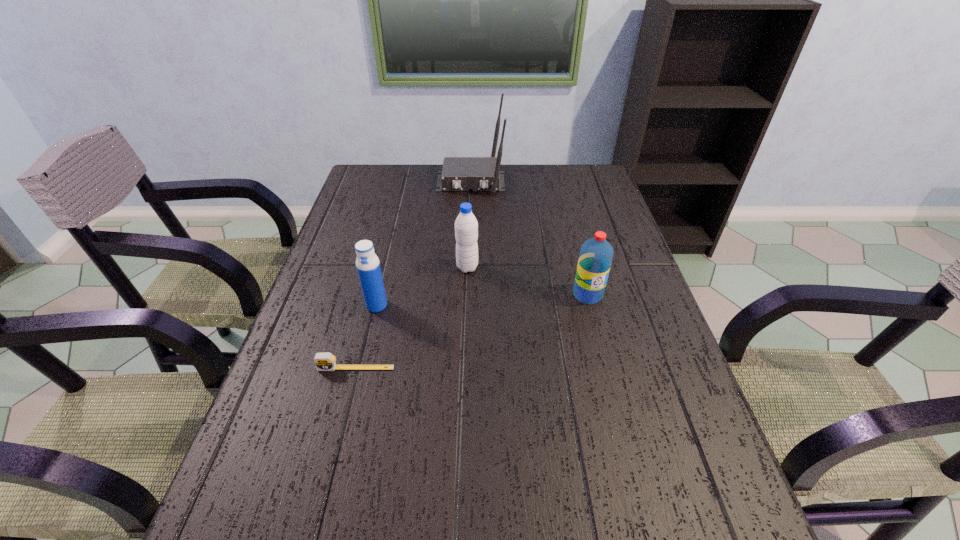
Locate an element on the screen. This screenshot has width=960, height=540. blank space located 0.370m on the front label of the rightmost object is located at coordinates coord(627,447).

Where is `vacant space located on the left of the leftmost water bottle`? This screenshot has width=960, height=540. vacant space located on the left of the leftmost water bottle is located at coordinates (330, 305).

This screenshot has width=960, height=540. Find the location of `vacant area situated at the front of the shortest object with the tape extended`. vacant area situated at the front of the shortest object with the tape extended is located at coordinates (345, 413).

Where is `object that is at the far edge`? This screenshot has width=960, height=540. object that is at the far edge is located at coordinates (459, 173).

Image resolution: width=960 pixels, height=540 pixels. In order to click on water bottle present at the left edge in this screenshot , I will do `click(368, 267)`.

Find the location of `tape measure that is positioned at the left edge`. tape measure that is positioned at the left edge is located at coordinates (x=325, y=361).

Where is `object located at the right edge`? object located at the right edge is located at coordinates (596, 254).

This screenshot has width=960, height=540. In the image, there is a desktop. Find the location of `vacant space at the far edge`. vacant space at the far edge is located at coordinates (554, 178).

Image resolution: width=960 pixels, height=540 pixels. In order to click on blank space at the left edge of the desktop in this screenshot , I will do `click(348, 247)`.

This screenshot has width=960, height=540. In the image, there is a desktop. Find the location of `blank space at the right edge`. blank space at the right edge is located at coordinates (612, 240).